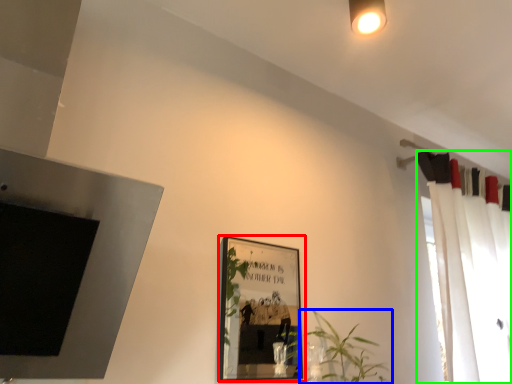
Question: Based on their relative distances, which object is farther from picture frame (highlighted by a red box)? Choose from houseplant (highlighted by a blue box) and curtain (highlighted by a green box).

Choices:
 (A) houseplant
 (B) curtain

Answer: (A)